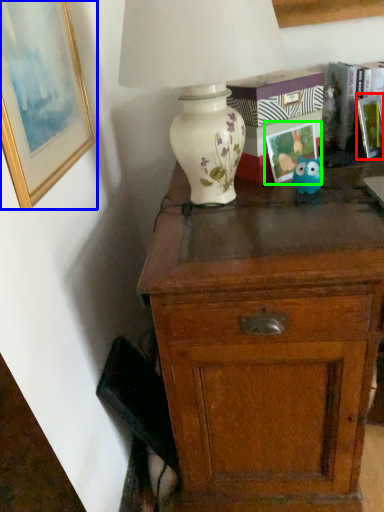
Question: Which object is the farthest from picture frame (highlighted by a red box)? Choose among these: picture frame (highlighted by a blue box) or picture frame (highlighted by a green box).

Choices:
 (A) picture frame
 (B) picture frame

Answer: (A)